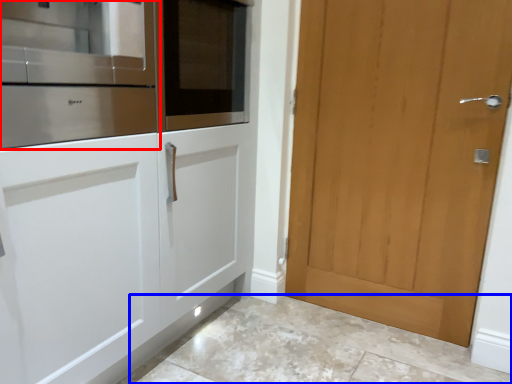
Question: Which object is further to the camera taking this photo, cabinetry (highlighted by a red box) or granite (highlighted by a blue box)?

Choices:
 (A) cabinetry
 (B) granite

Answer: (B)